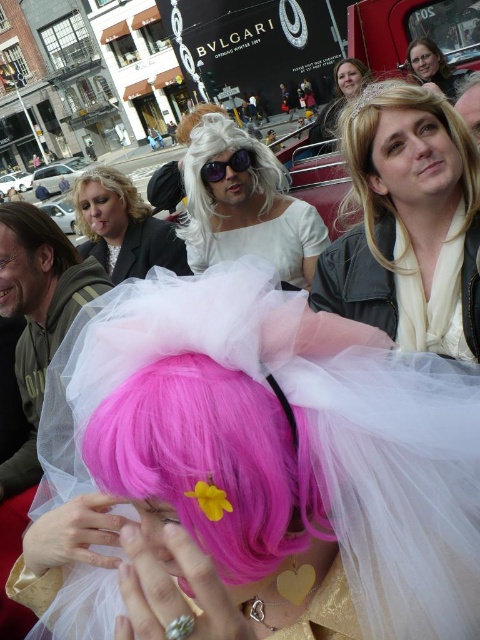
Between blonde silky hair at upper right and matte white tulle at upper center, which one is positioned higher?

matte white tulle at upper center

Which is behind, point (456, 115) or point (422, 51)?

The point (422, 51) is behind.

Find the location of a particular element. blonde silky hair at upper right is located at coordinates (372, 150).

Can you confirm if blondehair at upper left is taller than white fluffy wig at center?

In fact, blondehair at upper left may be shorter than white fluffy wig at center.

Between blondehair at upper left and white fluffy wig at center, which one has more height?

white fluffy wig at center is taller.

Which is in front, point (109, 186) or point (177, 140)?

Point (109, 186) is in front.

The height and width of the screenshot is (640, 480). Find the location of `blondehair at upper left`. blondehair at upper left is located at coordinates (111, 202).

What do you see at coordinates (252, 470) in the screenshot?
I see `pink tulle dress at center` at bounding box center [252, 470].

Who is lower down, pink tulle dress at center or pink tulle wig at center?

pink tulle dress at center is lower down.

Which is behind, point (78, 528) or point (28, 282)?

The point (28, 282) is behind.

At what (x,y) coordinates should I click in order to perform the action: click on pink tulle dress at center. Please return your answer as a coordinate pair (x, y). Looking at the image, I should click on (252, 470).